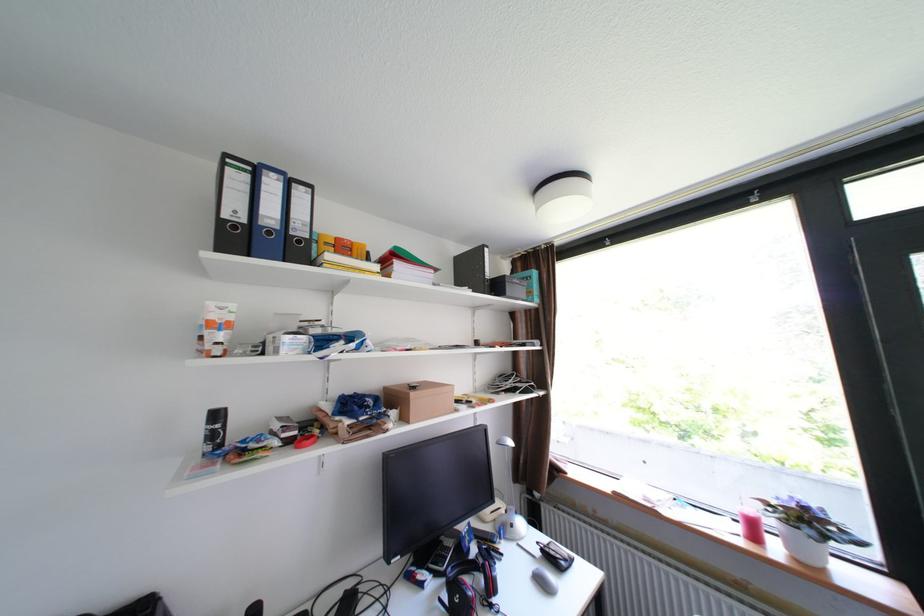
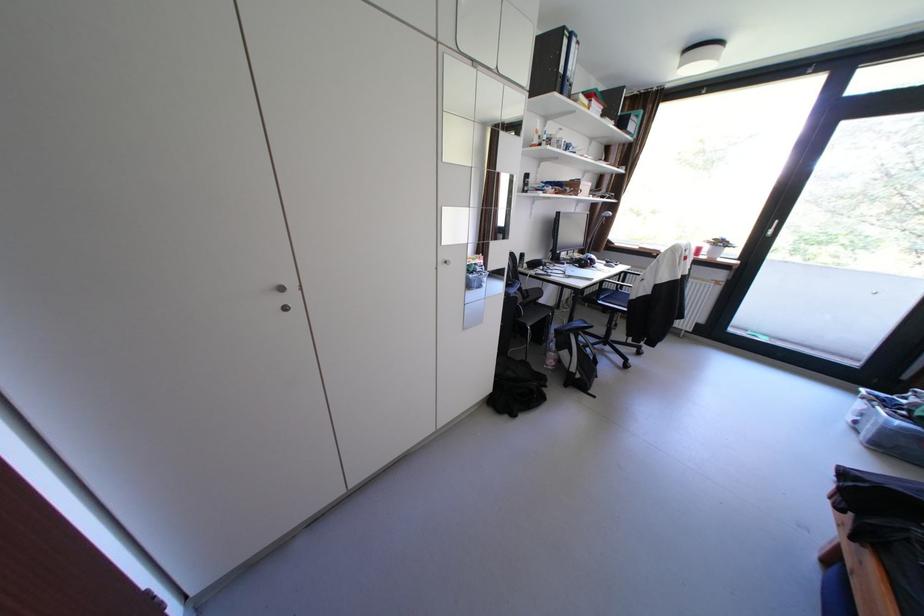
Where in the second image is the point corresponding to (x=432, y=586) from the first image?

(574, 264)